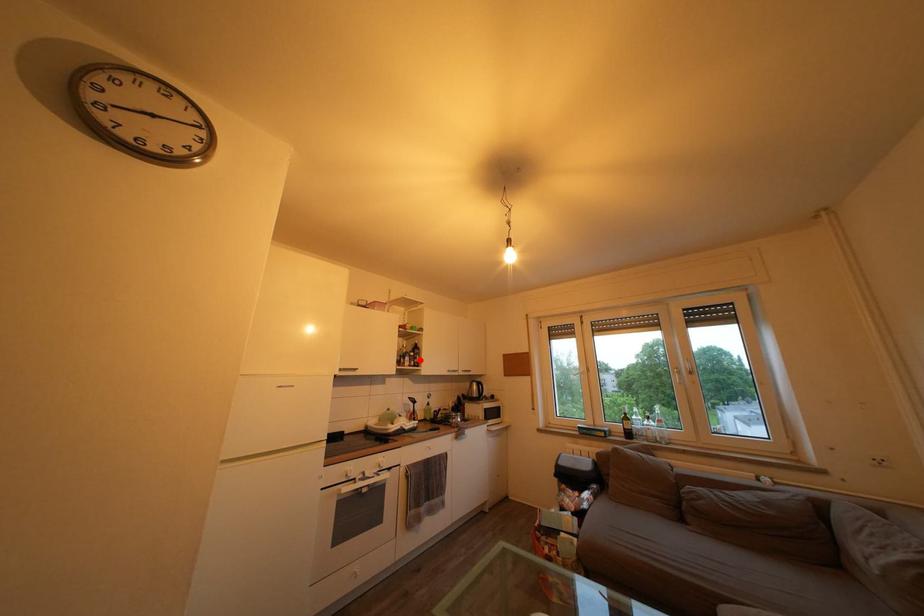
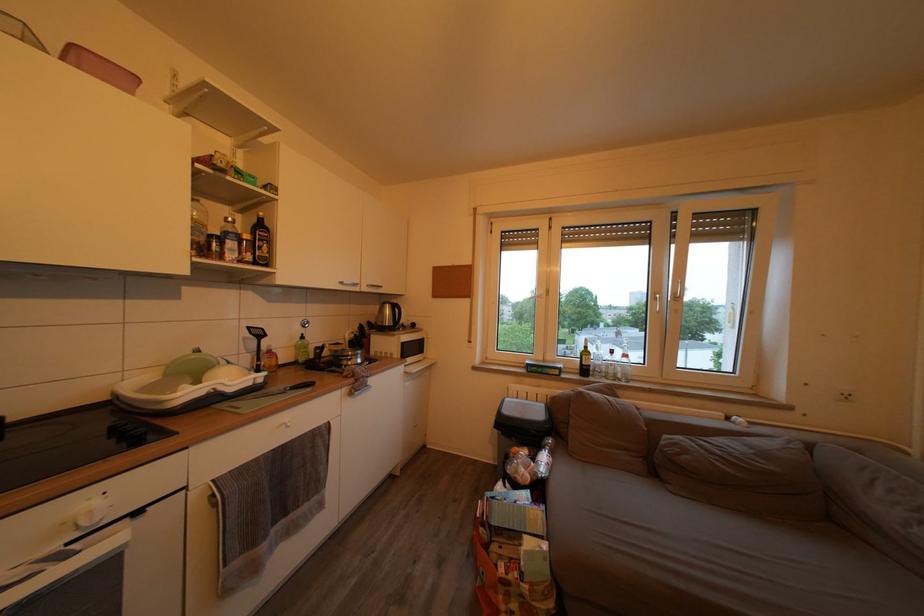
The point at the highlighted location is marked in the first image. Where is the corresponding point in the second image?

(253, 243)